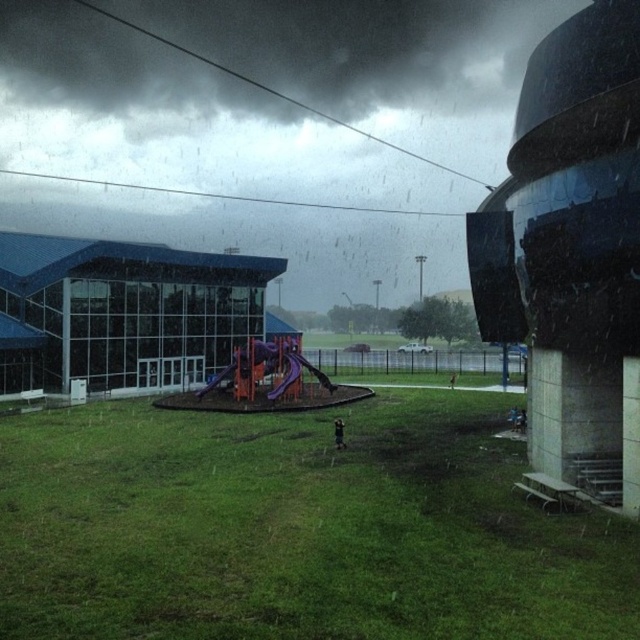
Question: Among these objects, which one is nearest to the camera?

Choices:
 (A) purple matte slide at center
 (B) green grassy field at center
 (C) purple plastic slide at center

Answer: (B)

Question: Is purple matte slide at center positioned at the back of purple plastic slide at center?

Choices:
 (A) no
 (B) yes

Answer: (B)

Question: Which object is positioned farthest from the green grassy field at center?

Choices:
 (A) purple matte slide at center
 (B) purple plastic slide at center

Answer: (B)

Question: Does green grassy field at center have a greater width compared to purple plastic slide at center?

Choices:
 (A) no
 (B) yes

Answer: (B)

Question: Which object appears farthest from the camera in this image?

Choices:
 (A) purple matte slide at center
 (B) green grassy field at center

Answer: (A)

Question: Does purple matte slide at center appear on the left side of purple plastic slide at center?

Choices:
 (A) no
 (B) yes

Answer: (B)